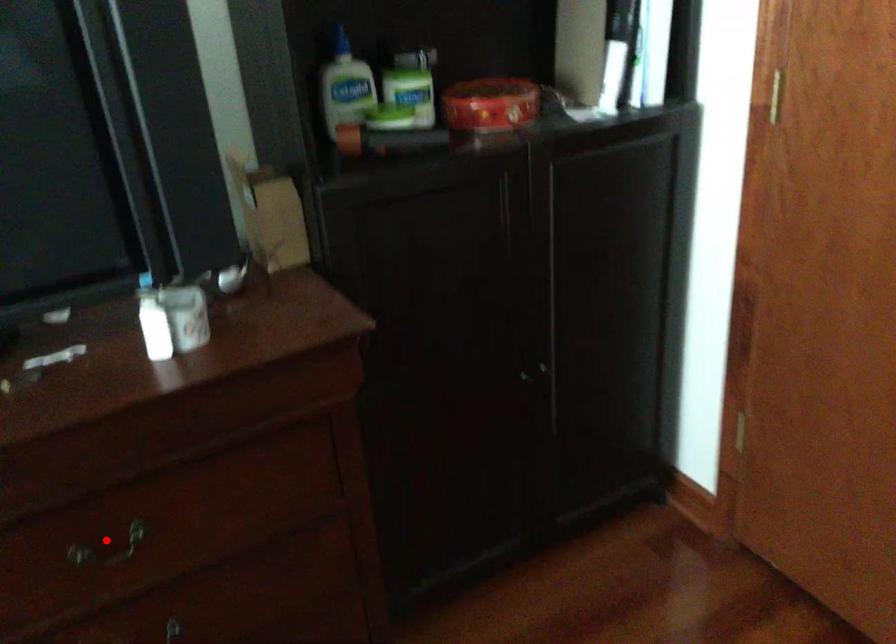
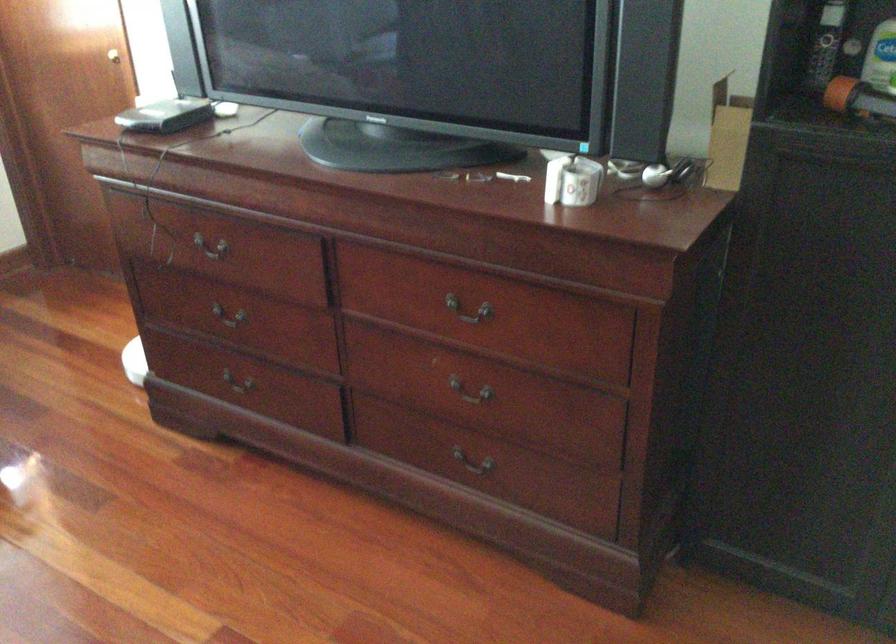
Question: I am providing you with two images of the same scene from different viewpoints. Image1 has a red point marked. In image2, the corresponding 3D location appears at what relative position? Reply with the corresponding letter.

Choices:
 (A) Closer
 (B) Farther

Answer: (B)